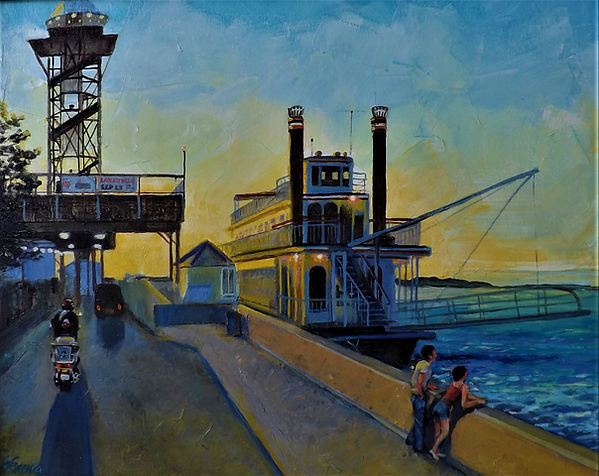
The height and width of the screenshot is (476, 599). I want to click on wall/barrier, so click(x=320, y=362).